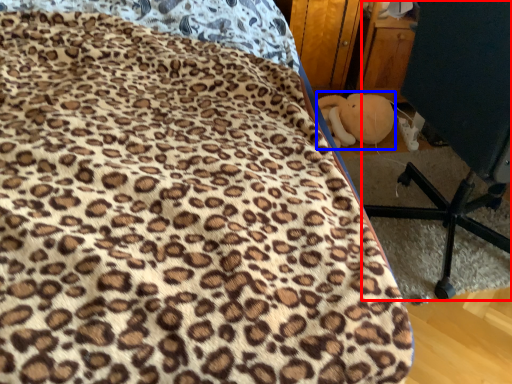
Question: Which of the following is the farthest to the observer, furniture (highlighted by a red box) or toy (highlighted by a blue box)?

Choices:
 (A) furniture
 (B) toy

Answer: (B)